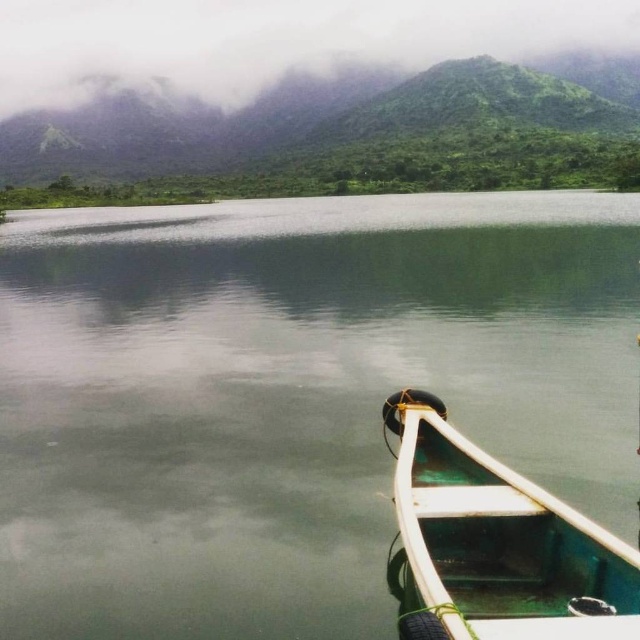
You are an observer looking at the serene lake scene. You notice the green matte mountain at upper center and the green matte boat at lower right. Which object is wider in the image?

The green matte mountain at upper center might be wider than the green matte boat at lower right according to the description.

From the picture: You are standing on the dock and looking at the green textured mountain at upper center and the green matte boat at lower right. Which object is located higher in the image?

The green textured mountain at upper center is located higher in the image than the green matte boat at lower right.

You are a photographer trying to capture the reflection of the boat in the green smooth water at center. Based on the coordinates provided, where should you position your camera to ensure the boat is fully reflected in the water?

The green smooth water at center is located at coordinates point (289, 396), so positioning the camera at that point will ensure the boat is fully reflected in the water.